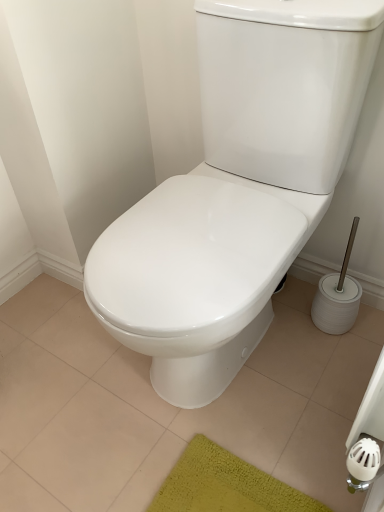
Where is `free space in front of white glossy toilet at center`? Image resolution: width=384 pixels, height=512 pixels. free space in front of white glossy toilet at center is located at coordinates (231, 441).